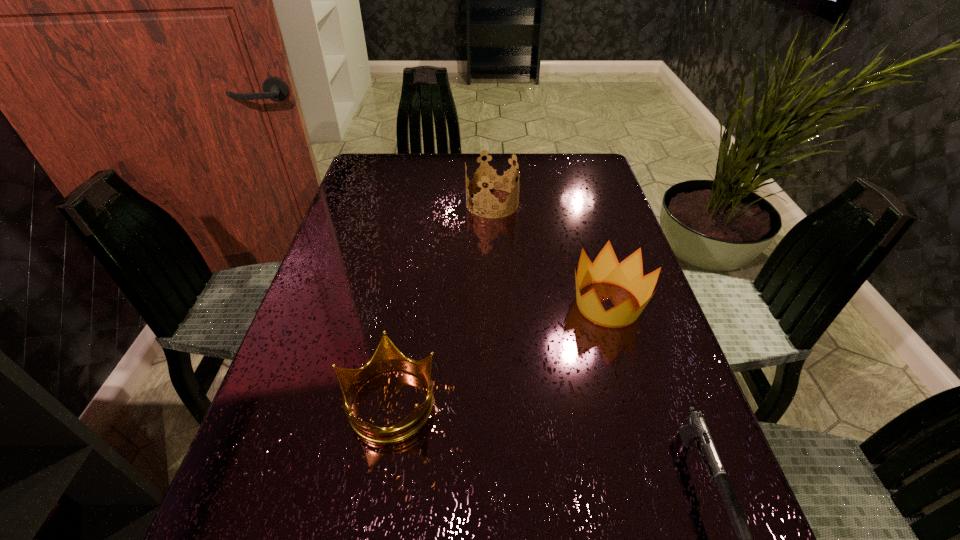
Point out which crown is positioned as the third nearest to the shortest object. Please provide its 2D coordinates. Your answer should be formatted as a tuple, i.e. [(x, y)], where the tuple contains the x and y coordinates of a point satisfying the conditions above.

[(492, 176)]

Locate an element on the screen. This screenshot has width=960, height=540. crown identified as the closest to the second nearest crown is located at coordinates (492, 176).

Image resolution: width=960 pixels, height=540 pixels. In order to click on vacant space that satisfies the following two spatial constraints: 1. on the back side of the farthest crown; 2. on the left side of the nearest crown in this screenshot , I will do `click(422, 203)`.

I want to click on blank area in the image that satisfies the following two spatial constraints: 1. on the back side of the third nearest object; 2. on the right side of the nearest crown, so click(405, 304).